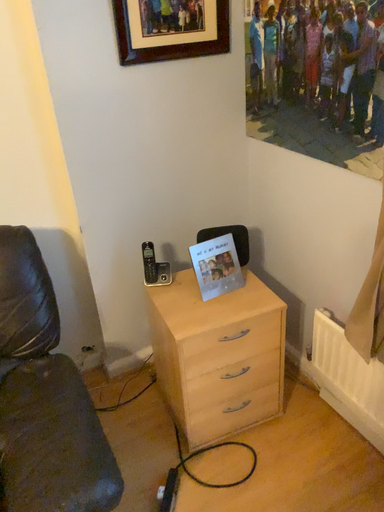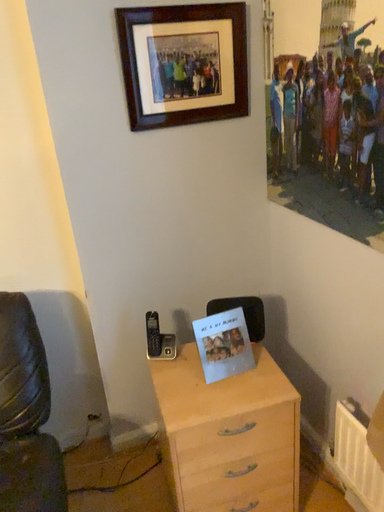
Question: Which way did the camera rotate in the video?

Choices:
 (A) rotated right
 (B) rotated left

Answer: (B)